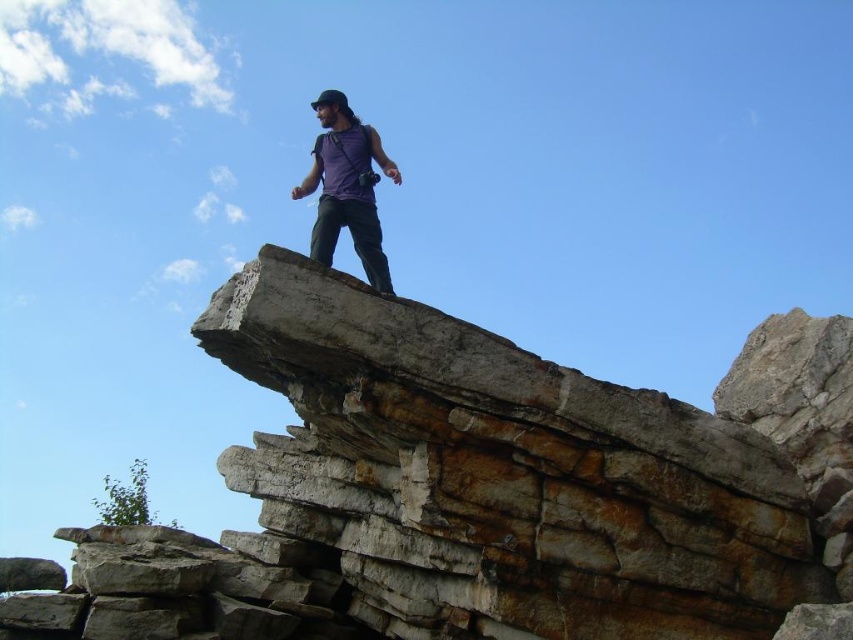
Is rusty stone cliff at center thinner than purple matte tank top at center?

No, rusty stone cliff at center is not thinner than purple matte tank top at center.

Is rusty stone cliff at center taller than purple matte tank top at center?

Yes.

Who is more distant from viewer, (x=779, y=442) or (x=380, y=268)?

Positioned behind is point (x=779, y=442).

Find the location of a particular element. rusty stone cliff at center is located at coordinates (483, 490).